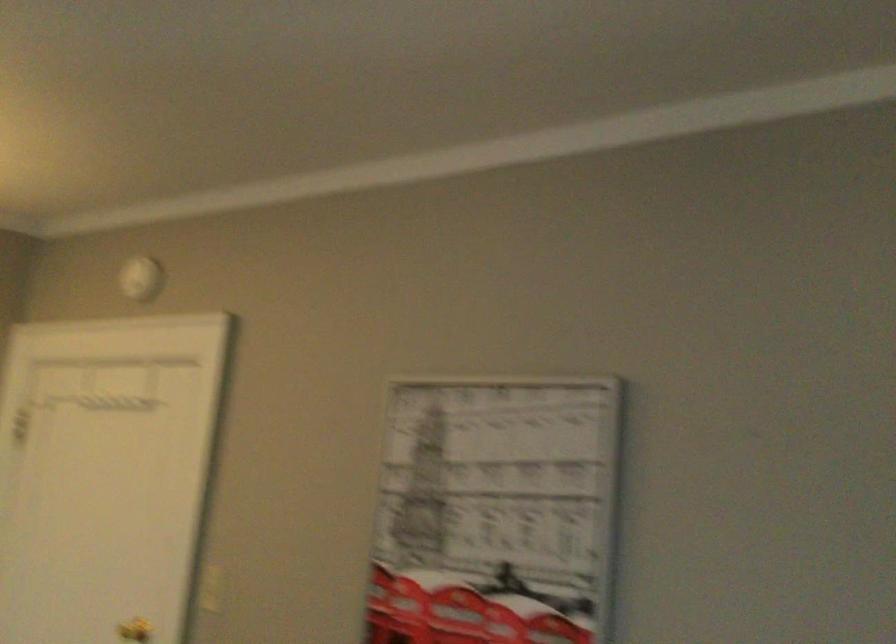
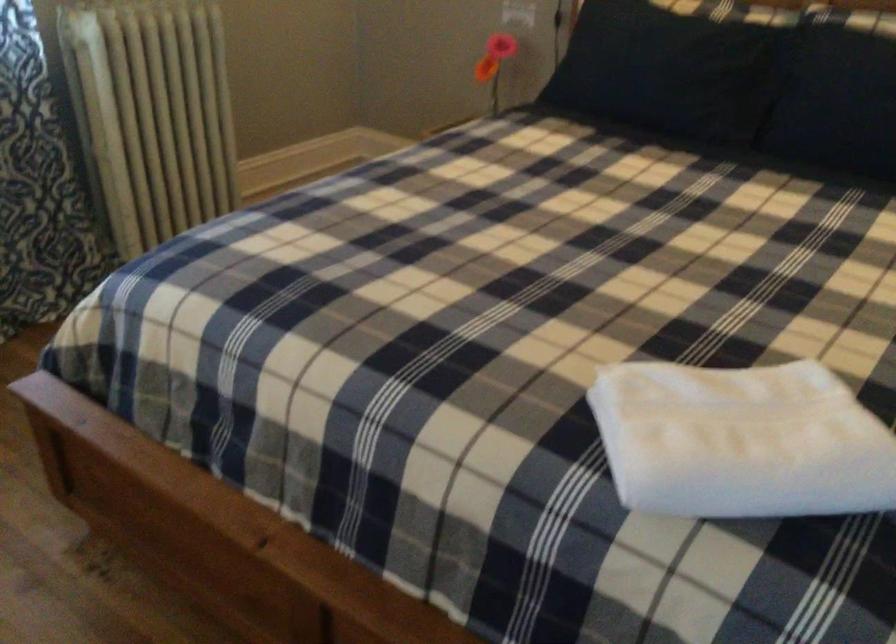
In the scene shown: The images are taken continuously from a first-person perspective. In which direction is your viewpoint rotating?

The camera rotated toward left-down.